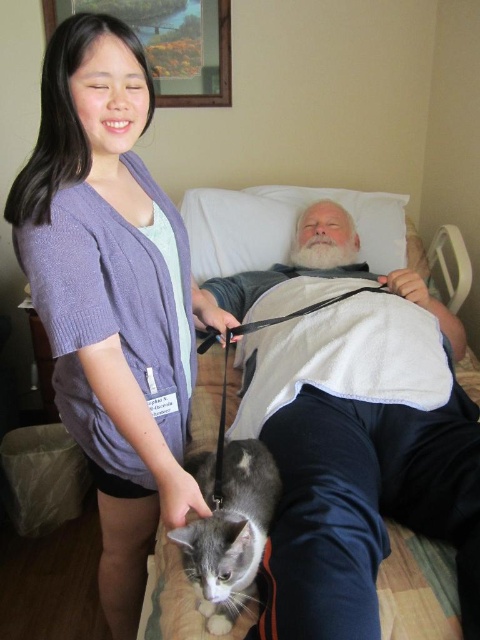
You are a photographer trying to capture a photo of the gray fur cat at lower center and the purple knitted cardigan at upper left. Which object should you focus on first if you want to start from the left side of the image?

The purple knitted cardigan at upper left should be focused on first since it is positioned to the left of the gray fur cat at lower center.

You are standing in the room and want to place a small plant pot exactly at the point marked as point (423, 428). If the plant pot is 0.5 meters tall, will it be visible from your current position?

The distance of point (423, 428) from camera is 1.19 meters. Since the plant pot is 0.5 meters tall, it will be visible from your current position as it is shorter than the distance.

You are a pet sitter who needs to ensure the cat is safe. Based on the image, is the gray fur cat at lower left currently on top of the purple knitted cardigan at upper left?

Yes, the gray fur cat at lower left is positioned over the purple knitted cardigan at upper left, so it is currently on top of it.